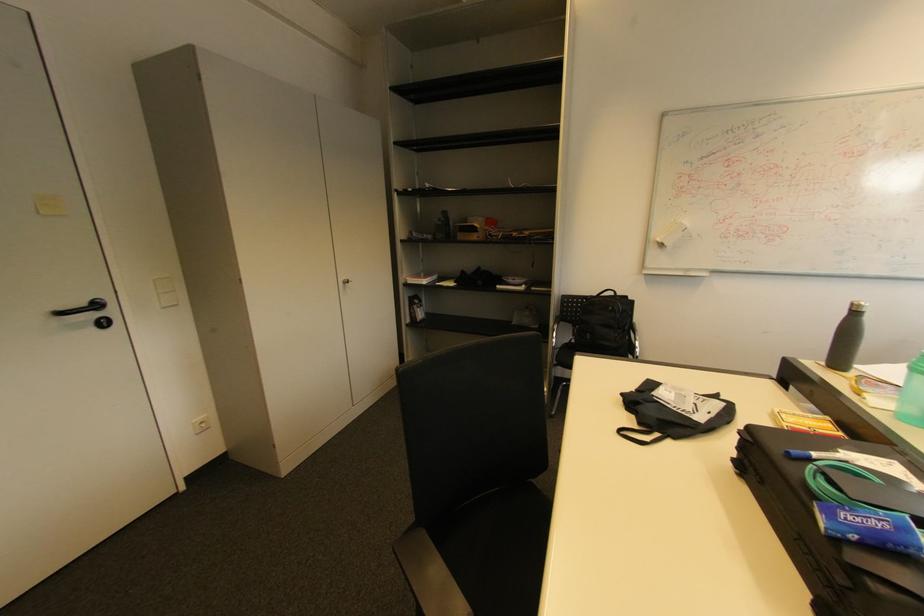
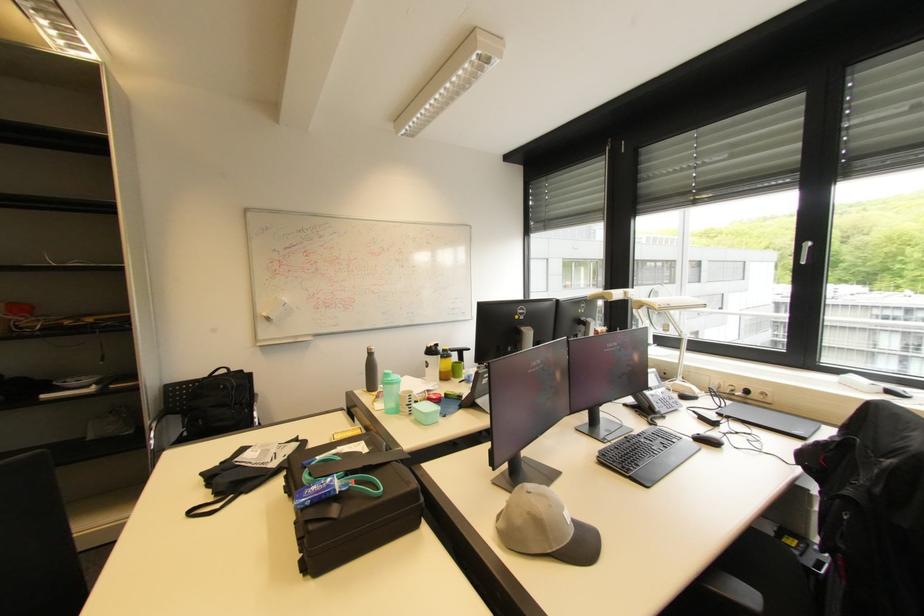
Where in the second image is the point corresponding to [857,305] from the first image?

(372, 350)